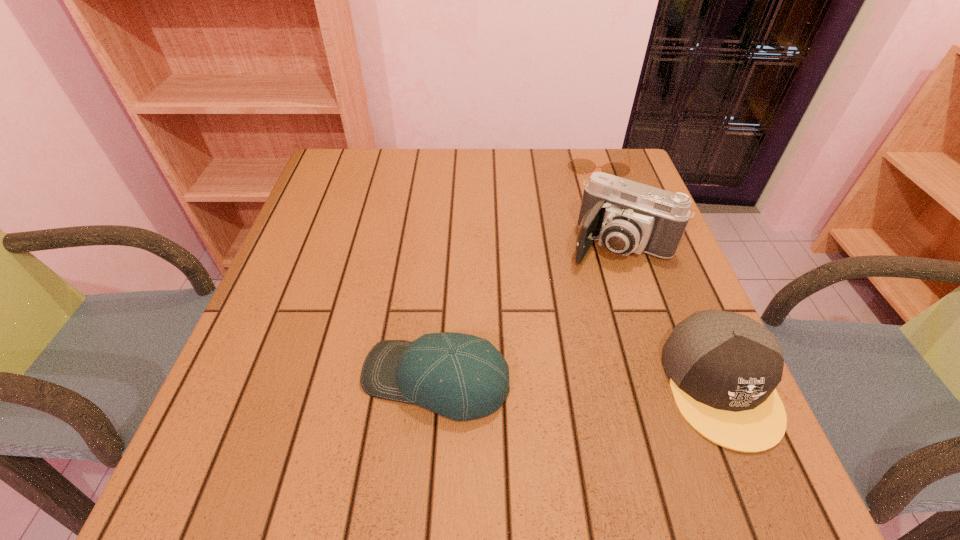
The height and width of the screenshot is (540, 960). I want to click on free space on the desktop that is between the baseball cap and the cap and is positioned on the face of the farthest object, so click(588, 383).

This screenshot has width=960, height=540. What are the coordinates of `vacant spot on the desktop that is between the baseball cap and the cap and is positioned at the front of the tallest object with an open lens cover` in the screenshot? It's located at (543, 382).